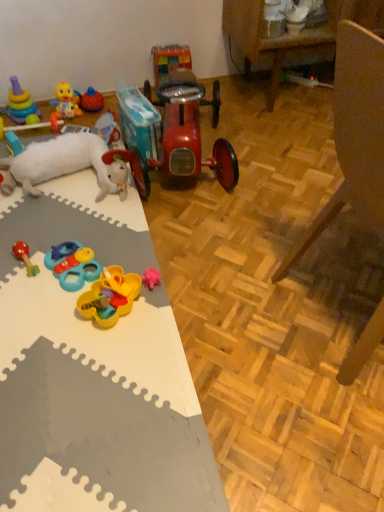
The width and height of the screenshot is (384, 512). Identify the location of vacant area that lies to the right of plastic/soft yellow and blue toy at lower left, the 4th toy viewed from the right. point(135,258).